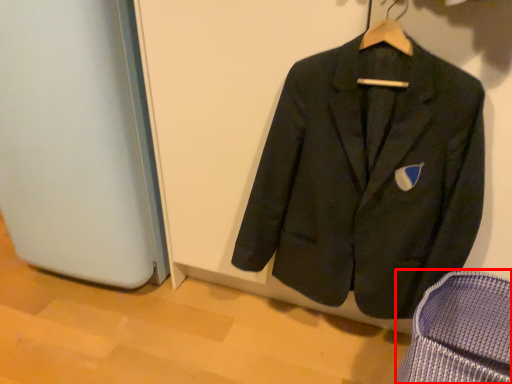
Question: Considering the relative positions of armchair (annotated by the red box) and suit in the image provided, where is armchair (annotated by the red box) located with respect to the staircase?

Choices:
 (A) left
 (B) right

Answer: (B)